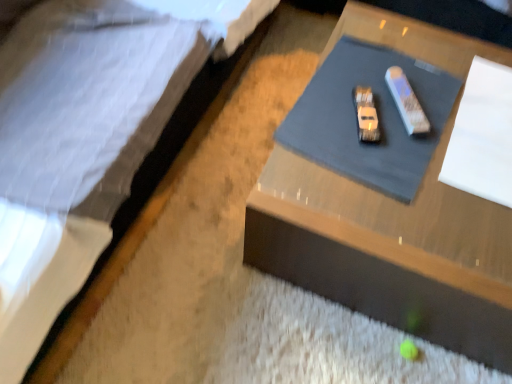
Question: From the image's perspective, is white quilted fabric at upper left positioned above or below wooden table at center?

Choices:
 (A) above
 (B) below

Answer: (A)

Question: In terms of width, does white quilted fabric at upper left look wider or thinner when compared to wooden table at center?

Choices:
 (A) thin
 (B) wide

Answer: (B)

Question: Which of these objects is positioned closest to the white paper at upper right?

Choices:
 (A) wooden table at center
 (B) white quilted fabric at upper left

Answer: (A)

Question: Estimate the real-world distances between objects in this image. Which object is closer to the wooden table at center?

Choices:
 (A) white quilted fabric at upper left
 (B) white paper at upper right

Answer: (B)